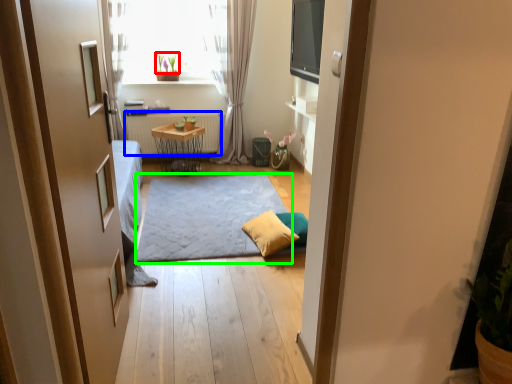
Question: Considering the real-world distances, which object is farthest from plant (highlighted by a red box)? radiator (highlighted by a blue box) or doormat (highlighted by a green box)?

Choices:
 (A) radiator
 (B) doormat

Answer: (B)